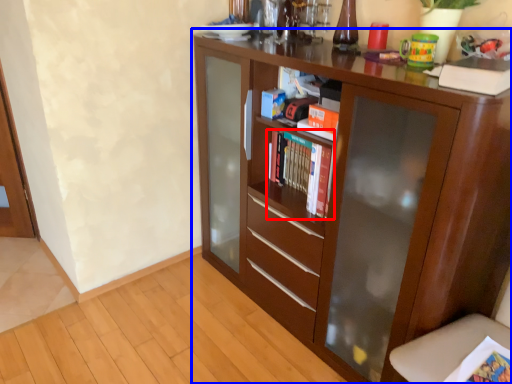
Question: Among these objects, which one is nearest to the camera, book (highlighted by a red box) or cupboard (highlighted by a blue box)?

Choices:
 (A) book
 (B) cupboard

Answer: (B)